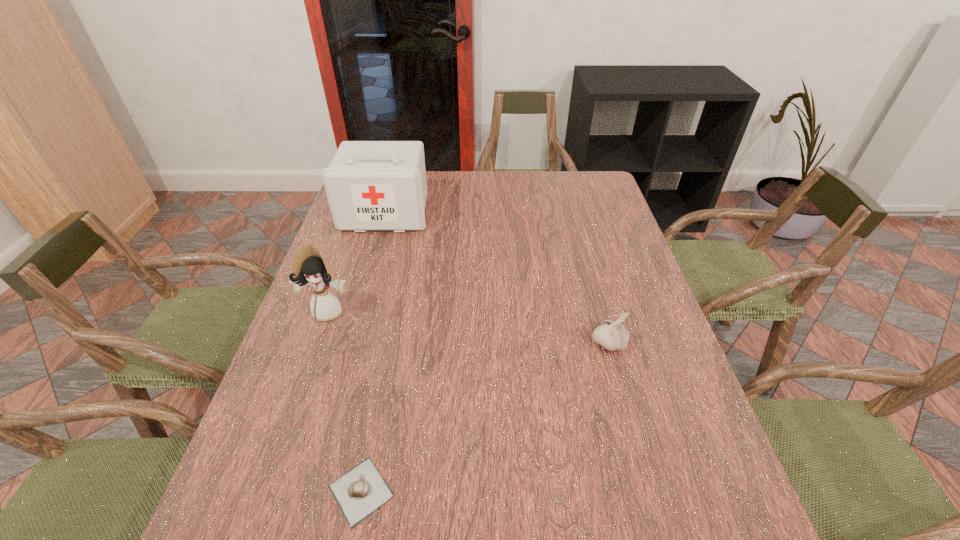
The height and width of the screenshot is (540, 960). What are the coordinates of `vacant point located 0.170m on the back of the right garlic` in the screenshot? It's located at (591, 284).

Where is `vacant region located 0.060m on the back of the shortest object`? vacant region located 0.060m on the back of the shortest object is located at coordinates pos(373,429).

This screenshot has width=960, height=540. Identify the location of object that is at the far edge. (371, 185).

I want to click on object that is at the near edge, so click(x=362, y=490).

At what (x,y) coordinates should I click in order to perform the action: click on the first-aid kit at the left edge. Please return your answer as a coordinate pair (x, y). Looking at the image, I should click on (371, 185).

Identify the location of doll present at the left edge. (309, 268).

This screenshot has width=960, height=540. In order to click on object at the right edge in this screenshot , I will do `click(612, 335)`.

Find the location of a particular element. object that is positioned at the far left corner is located at coordinates (371, 185).

In the image, there is a desktop. Identify the location of vacant space at the far edge. pos(475,199).

In the image, there is a desktop. Identify the location of vacant space at the left edge. Image resolution: width=960 pixels, height=540 pixels. (343, 242).